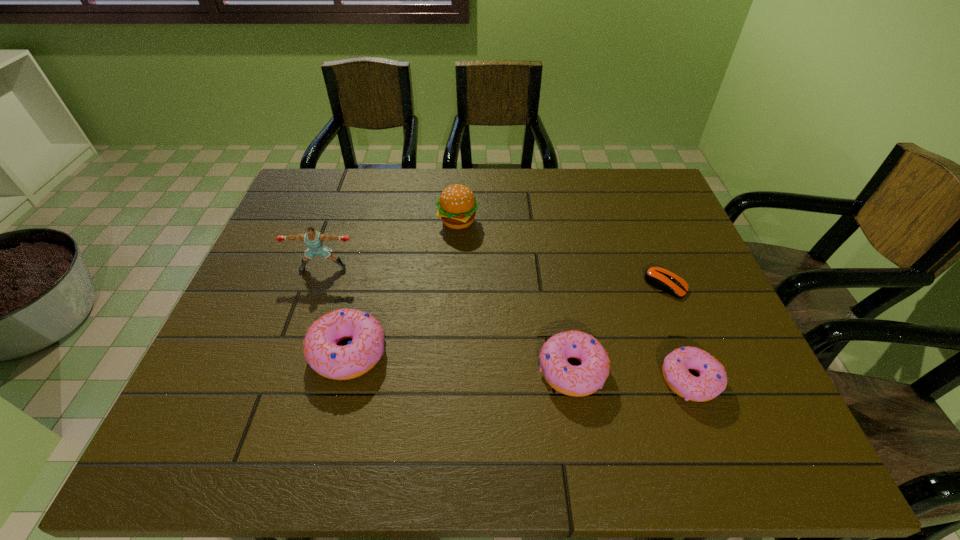
This screenshot has height=540, width=960. In order to click on the leftmost doughnut in this screenshot , I will do `click(321, 351)`.

Locate an element on the screen. the second doughnut from right to left is located at coordinates (583, 380).

Identify the location of the second shortest doughnut. This screenshot has width=960, height=540. (583, 380).

I want to click on the second shortest object, so click(712, 380).

Where is `the shortest doughnut`? The width and height of the screenshot is (960, 540). the shortest doughnut is located at coordinates (712, 380).

You are a GUI agent. You are given a task and a screenshot of the screen. Output one action in this format:
    pyautogui.click(x=<x>, y=<y>)
    Task: Click on the computer mouse
    The image size is (960, 540).
    Given the screenshot: What is the action you would take?
    pyautogui.click(x=660, y=278)

You are a GUI agent. You are given a task and a screenshot of the screen. Output one action in this format:
    pyautogui.click(x=<x>, y=<y>)
    Task: Click on the hamburger
    
    Given the screenshot: What is the action you would take?
    pyautogui.click(x=457, y=205)

Where is `the farthest object`? the farthest object is located at coordinates (457, 205).

Locate an element on the screen. The image size is (960, 540). the tallest object is located at coordinates (314, 239).

What are the coordinates of `vacant region located 0.290m on the back of the leftmost doughnut` in the screenshot? It's located at (376, 241).